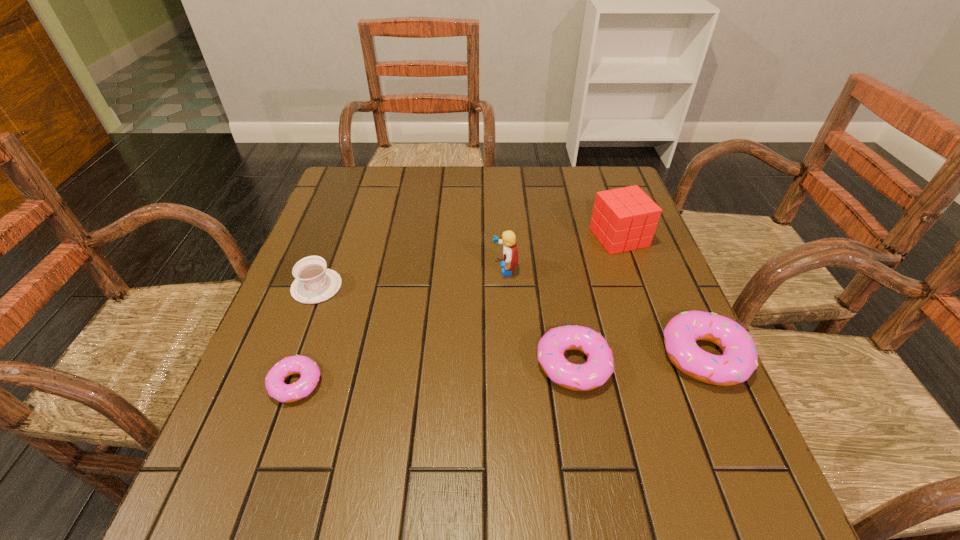
The width and height of the screenshot is (960, 540). In order to click on vacant space located 0.230m on the left of the rightmost doughnut in this screenshot , I will do `click(547, 356)`.

Identify the location of vacant space located on the handle side of the teacup. This screenshot has height=540, width=960. (273, 406).

What are the coordinates of `blank area located on the front-facing side of the Lego` in the screenshot? It's located at (406, 269).

Locate an element on the screen. free spot located on the front-facing side of the Lego is located at coordinates (397, 269).

Where is `vacant space situated 0.080m on the front-facing side of the Lego`? vacant space situated 0.080m on the front-facing side of the Lego is located at coordinates (459, 269).

Find the location of a particular element. This screenshot has width=960, height=540. free region located on the back of the farthest object is located at coordinates click(x=602, y=189).

The width and height of the screenshot is (960, 540). Identify the location of object at the near edge. (298, 364).

At what (x,y) coordinates should I click in order to perform the action: click on doughnut positioned at the left edge. Please return your answer as a coordinate pair (x, y). This screenshot has height=540, width=960. Looking at the image, I should click on (298, 364).

You are a GUI agent. You are given a task and a screenshot of the screen. Output one action in this format:
    pyautogui.click(x=<x>, y=<y>)
    Task: Click on the teacup situated at the left edge
    The image size is (960, 540).
    Given the screenshot: What is the action you would take?
    pyautogui.click(x=314, y=283)

Locate an element on the screen. This screenshot has height=540, width=960. doughnut that is at the right edge is located at coordinates (739, 360).